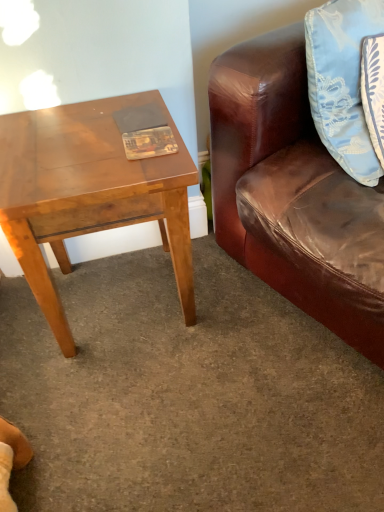
The image size is (384, 512). I want to click on vacant area situated to the left side of matte plastic book at center, so click(x=81, y=164).